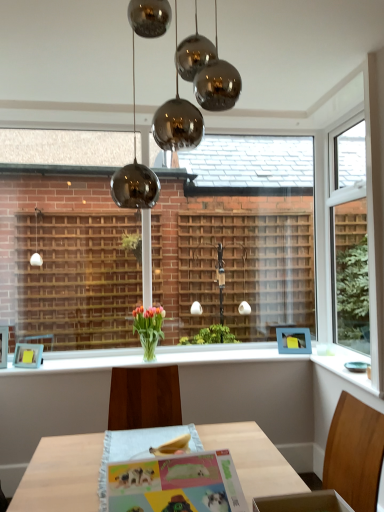
Question: Is matte paper postcard at center touching white glossy plate at lower right, the 1th window sill viewed from the right?

Choices:
 (A) no
 (B) yes

Answer: (A)

Question: Does matte paper postcard at center have a lesser height compared to white glossy plate at lower right, the 1th window sill viewed from the right?

Choices:
 (A) yes
 (B) no

Answer: (B)

Question: Is matte paper postcard at center in front of white glossy plate at lower right, acting as the 2th window sill starting from the left?

Choices:
 (A) no
 (B) yes

Answer: (B)

Question: From the image's perspective, is matte paper postcard at center above white glossy plate at lower right, acting as the 2th window sill starting from the left?

Choices:
 (A) no
 (B) yes

Answer: (B)

Question: Is matte paper postcard at center at the right side of white glossy plate at lower right, the 1th window sill viewed from the right?

Choices:
 (A) no
 (B) yes

Answer: (A)

Question: From a real-world perspective, is translucent glass vase at center positioned above or below white glossy window sill at center, placed as the 1th window sill when sorted from left to right?

Choices:
 (A) above
 (B) below

Answer: (A)

Question: Considering the positions of translucent glass vase at center and white glossy window sill at center, positioned as the second window sill in right-to-left order, in the image, is translucent glass vase at center bigger or smaller than white glossy window sill at center, positioned as the second window sill in right-to-left order,?

Choices:
 (A) big
 (B) small

Answer: (A)

Question: Considering the positions of translucent glass vase at center and white glossy window sill at center, placed as the 1th window sill when sorted from left to right, in the image, is translucent glass vase at center taller or shorter than white glossy window sill at center, placed as the 1th window sill when sorted from left to right,?

Choices:
 (A) short
 (B) tall

Answer: (B)

Question: From the image's perspective, relative to white glossy window sill at center, placed as the 1th window sill when sorted from left to right, is translucent glass vase at center above or below?

Choices:
 (A) below
 (B) above

Answer: (B)

Question: Is polished chrome chandelier at upper center taller or shorter than white glossy plate at lower right, acting as the 2th window sill starting from the left?

Choices:
 (A) tall
 (B) short

Answer: (A)

Question: In the image, is polished chrome chandelier at upper center on the left side or the right side of white glossy plate at lower right, the 1th window sill viewed from the right?

Choices:
 (A) left
 (B) right

Answer: (A)

Question: Looking at their shapes, would you say polished chrome chandelier at upper center is wider or thinner than white glossy plate at lower right, acting as the 2th window sill starting from the left?

Choices:
 (A) thin
 (B) wide

Answer: (B)

Question: Which is correct: polished chrome chandelier at upper center is inside white glossy plate at lower right, acting as the 2th window sill starting from the left, or outside of it?

Choices:
 (A) outside
 (B) inside

Answer: (A)

Question: From their relative heights in the image, would you say matte glass vase at center is taller or shorter than matte paper postcard at center?

Choices:
 (A) tall
 (B) short

Answer: (A)

Question: From a real-world perspective, is matte glass vase at center physically located above or below matte paper postcard at center?

Choices:
 (A) above
 (B) below

Answer: (A)